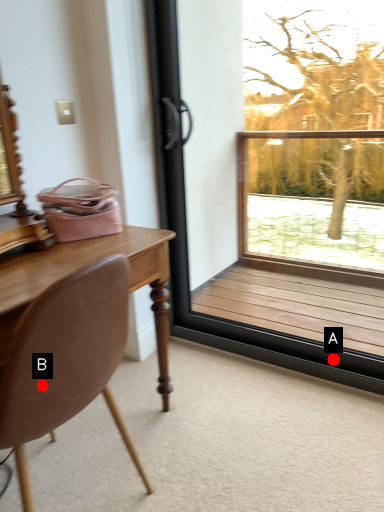
Question: Two points are circled on the image, labeled by A and B beside each circle. Which of the following is the farthest from the observer?

Choices:
 (A) A is further
 (B) B is further

Answer: (A)